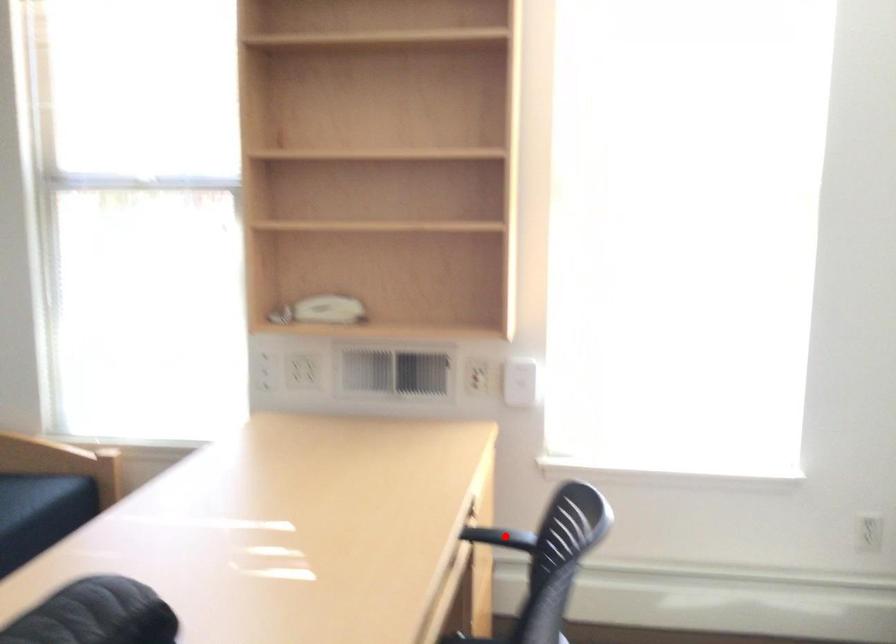
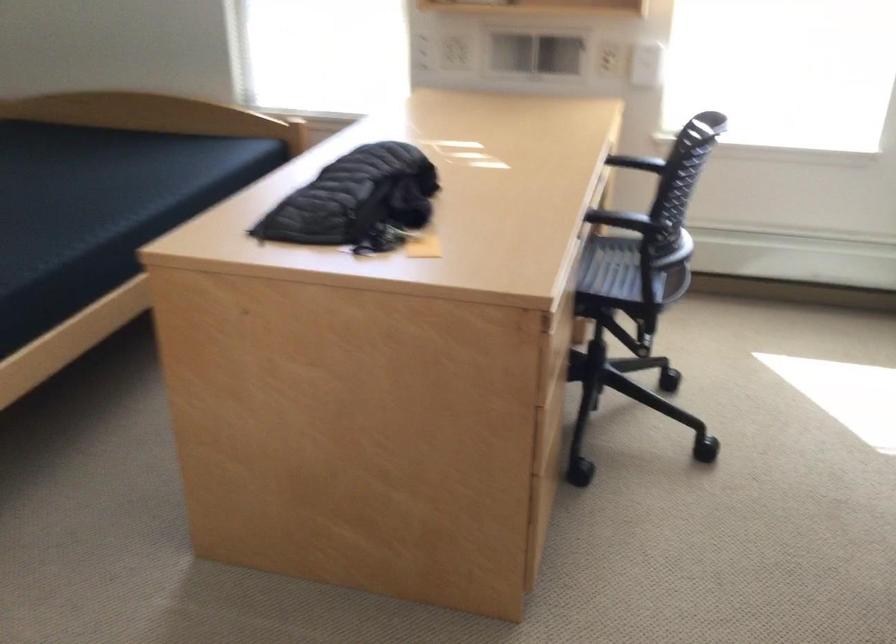
Question: I am providing you with two images of the same scene from different viewpoints. A red point is marked on the first image. Is the red point's position out of view in image 2?

Choices:
 (A) Yes
 (B) No

Answer: (A)